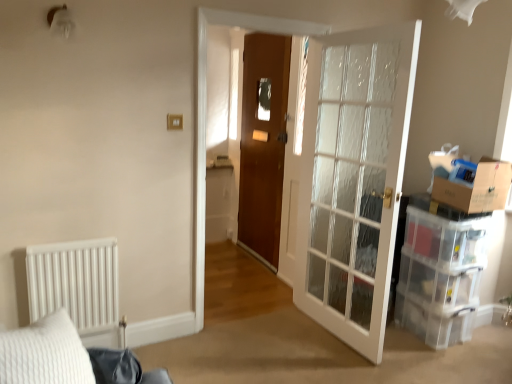
Find the location of a particular element. This screenshot has width=512, height=384. vacant space underneath clear glass door at right (from a real-world perspective) is located at coordinates (323, 336).